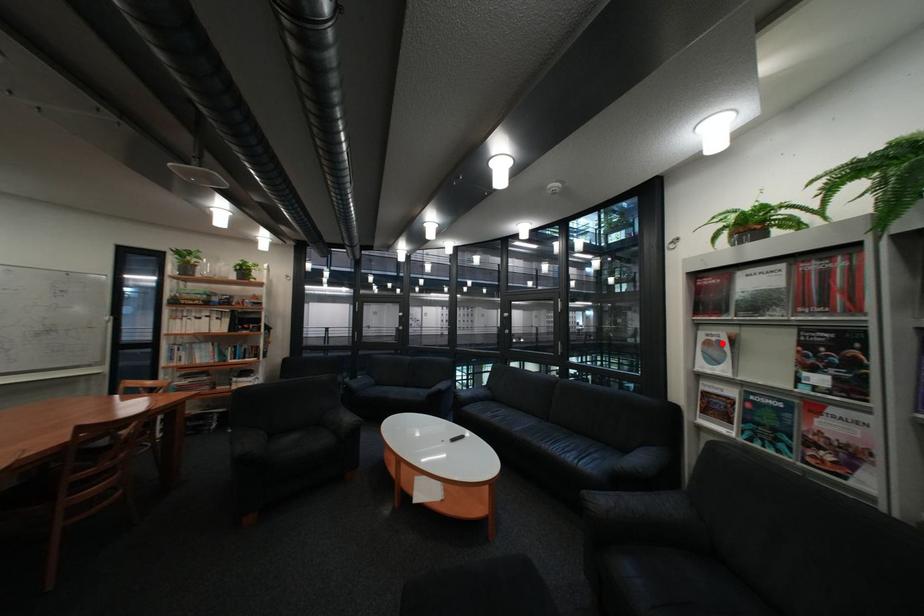
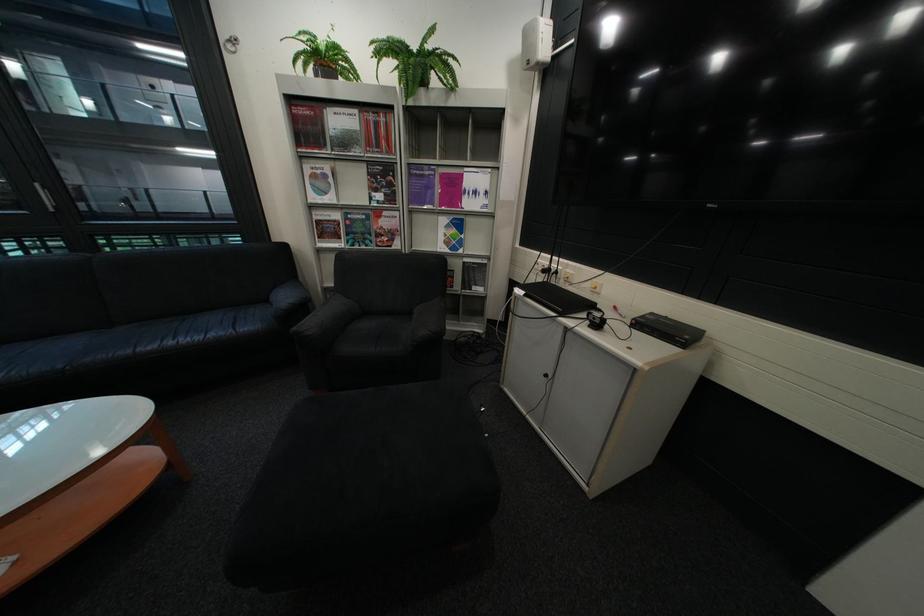
Find the pixel in the second image that matches the highlighted location in the first image.

(329, 177)